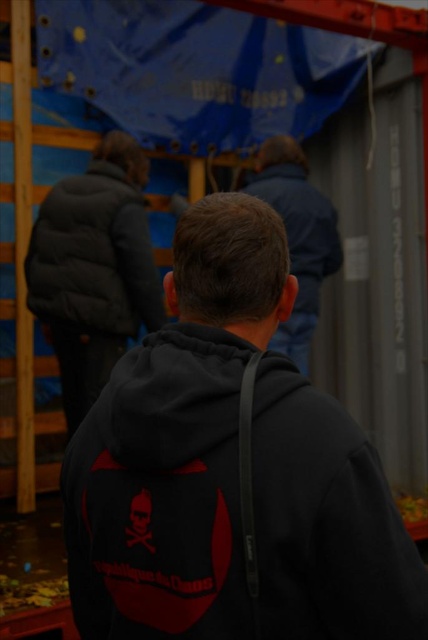
You are a safety inspector at a construction site. You need to ensure that all workers are wearing proper safety gear. You see two workers wearing the dark gray puffy jacket at upper left and the dark blue jacket at center. Which worker is wearing a jacket that is shorter in length?

The dark gray puffy jacket at upper left is shorter than the dark blue jacket at center, so the worker wearing the dark gray puffy jacket at upper left has a shorter jacket.

You are a delivery person who needs to deliver a package to the person in the dark blue jacket at center. You are currently standing at the black matte hoodie at center. The package is too heavy to carry while walking through narrow spaces. What is the minimum width of the path between these two individuals to ensure safe delivery?

The path between the black matte hoodie at center and the dark blue jacket at center is 2.24 meters wide. Since the package requires a minimum of 2 meters of space for safe delivery, the path is wide enough to accommodate the delivery without difficulty.